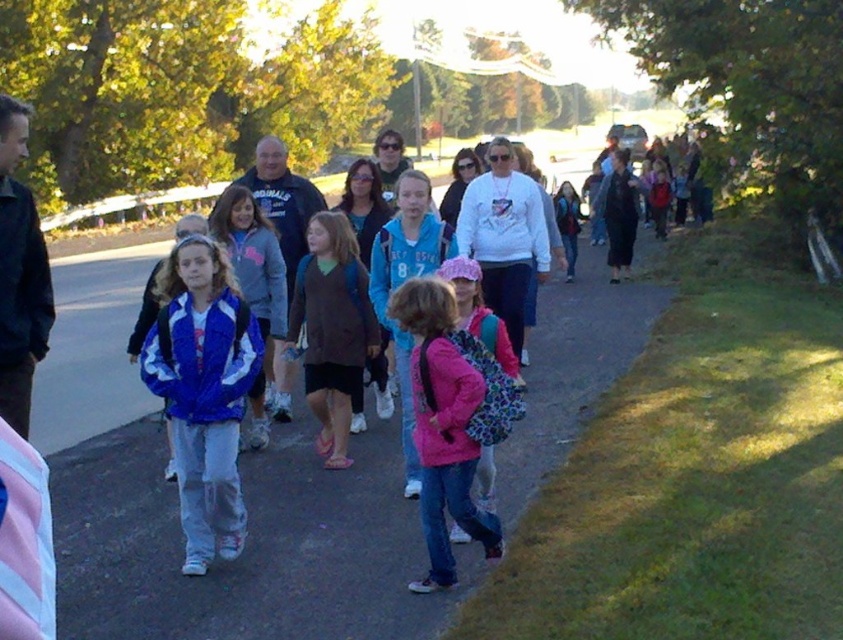
Is pink fabric backpack at center bigger than dark blue hoodie at center?

No, pink fabric backpack at center is not bigger than dark blue hoodie at center.

Who is taller, pink fabric backpack at center or dark blue hoodie at center?

With more height is dark blue hoodie at center.

Who is more forward, (401, 304) or (272, 380)?

Positioned in front is point (401, 304).

Locate an element on the screen. pink fabric backpack at center is located at coordinates (443, 426).

Is pink fabric backpack at center above white matte sweatshirt at center?

Incorrect, pink fabric backpack at center is not positioned above white matte sweatshirt at center.

Which is behind, point (425, 467) or point (495, 166)?

Point (495, 166)

You are a GUI agent. You are given a task and a screenshot of the screen. Output one action in this format:
    pyautogui.click(x=<x>, y=<y>)
    Task: Click on the pink fabric backpack at center
    This screenshot has width=843, height=640.
    Given the screenshot: What is the action you would take?
    pyautogui.click(x=443, y=426)

Is point (74, 616) farther from camera compared to point (347, 433)?

No.

Can you confirm if blue fabric backpack at center is positioned to the right of brown sweater at center?

Yes, blue fabric backpack at center is to the right of brown sweater at center.

Is point (138, 576) more distant than point (310, 262)?

No, (138, 576) is closer to viewer.

Where is `blue fabric backpack at center`? blue fabric backpack at center is located at coordinates (247, 547).